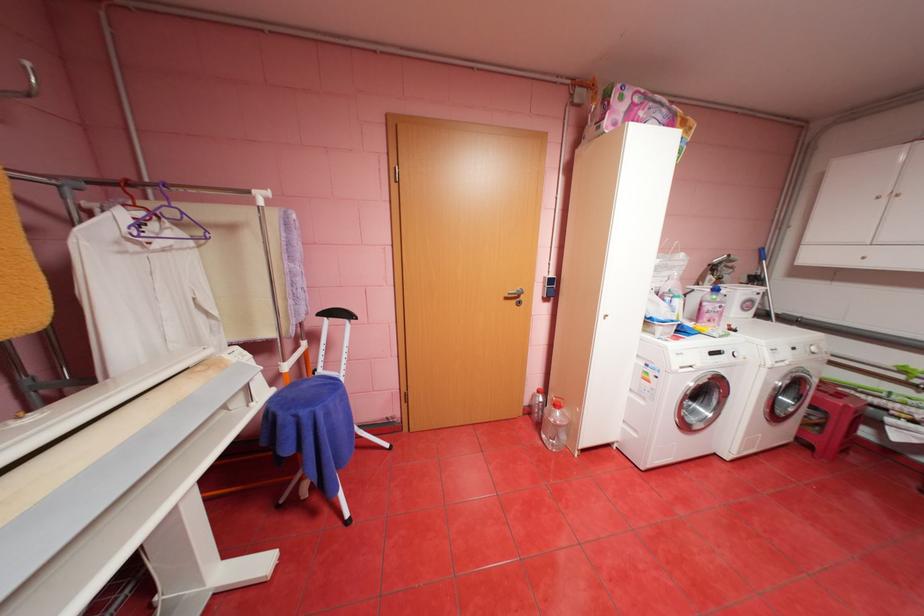
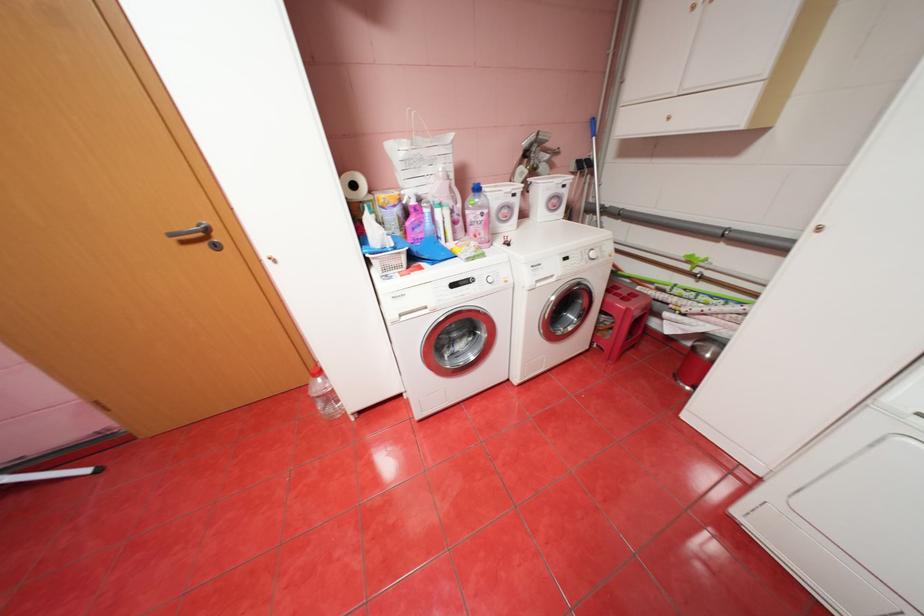
Locate, in the second image, the point that corresponds to (x=759, y=301) in the first image.

(566, 197)